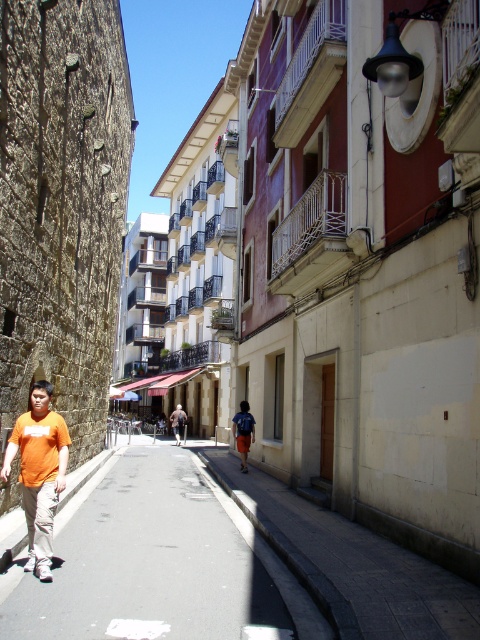
You are a delivery person trying to park your bike. The bike requires a flat surface. Which surface would be suitable between the smooth asphalt road at center and the smooth concrete sidewalk at center?

The smooth concrete sidewalk at center is suitable because it is above the smooth asphalt road at center, making it a stable surface for parking.

You are a delivery person carrying a large package and need to walk along the street while avoiding stepping on the orange cotton shirt at left. Is the smooth concrete sidewalk at center wide enough to safely navigate with your package?

The smooth concrete sidewalk at center might be wider than orange cotton shirt at left, so it is likely wide enough to safely navigate with your package while avoiding the orange cotton shirt at left.

You are standing at the point labeled as point (156, 563) in the image. What type of surface are you currently standing on?

You are standing on the smooth asphalt road at center.